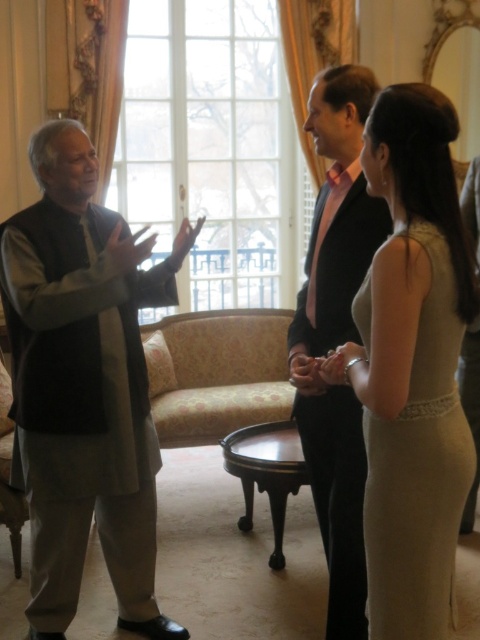
Does point (66, 346) come behind point (344, 586)?

Yes, point (66, 346) is farther from viewer.

I want to click on matte gray vest at left, so click(84, 385).

Does point (139, 234) come farther from viewer compared to point (332, 92)?

No, (139, 234) is closer to viewer.

Find the location of `matte gray vest at left`. matte gray vest at left is located at coordinates (84, 385).

Between matte gray vest at left and satin beige dress at right, which one has less height?

With less height is satin beige dress at right.

Which is more to the left, matte gray vest at left or satin beige dress at right?

matte gray vest at left is more to the left.

Locate an element on the screen. This screenshot has height=640, width=480. matte gray vest at left is located at coordinates (84, 385).

I want to click on matte gray vest at left, so click(84, 385).

Between point (336, 152) and point (420, 566), which one is positioned in front?

Point (420, 566)

Does matte black suit at center have a greater width compared to satin beige dress at right?

Correct, the width of matte black suit at center exceeds that of satin beige dress at right.

Image resolution: width=480 pixels, height=640 pixels. I want to click on matte black suit at center, so (x=336, y=336).

Locate an element on the screen. Image resolution: width=480 pixels, height=640 pixels. matte black suit at center is located at coordinates (336, 336).